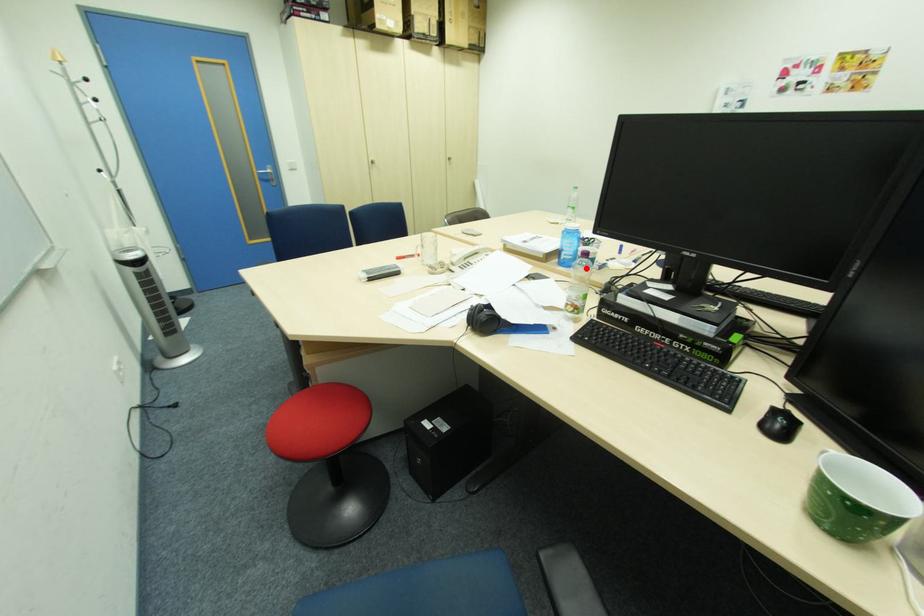
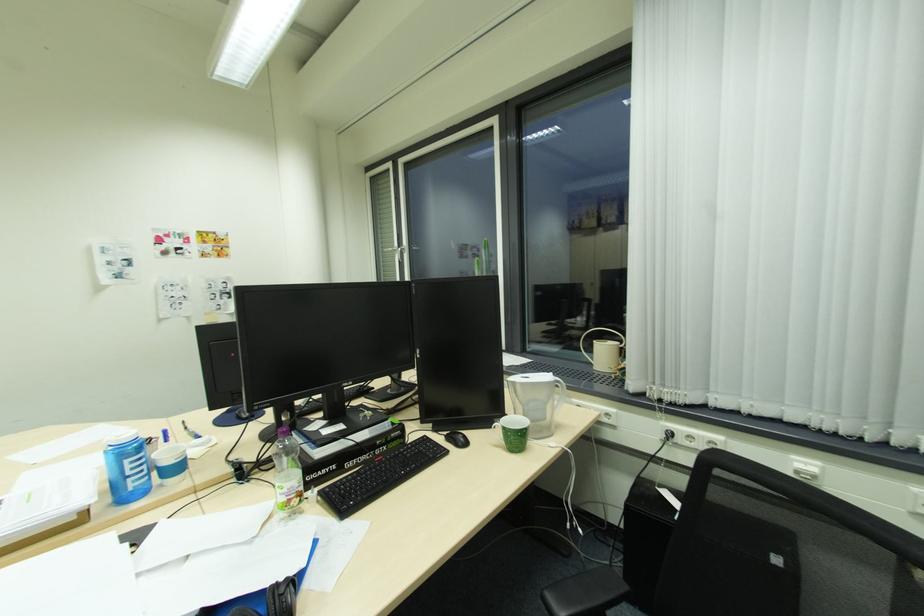
Where in the second image is the point corresponding to the highlighted location from the first image?

(176, 482)